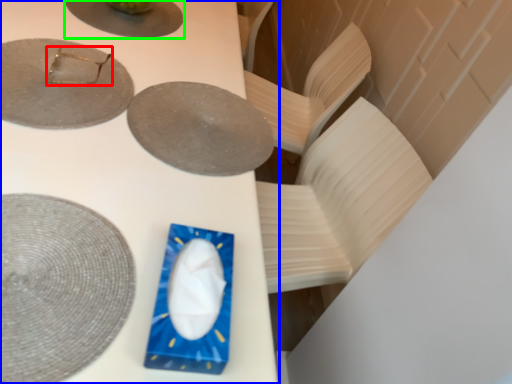
Question: Which object is positioned farthest from tableware (highlighted by a red box)? Select from table (highlighted by a blue box) and plate (highlighted by a green box).

Choices:
 (A) table
 (B) plate

Answer: (A)